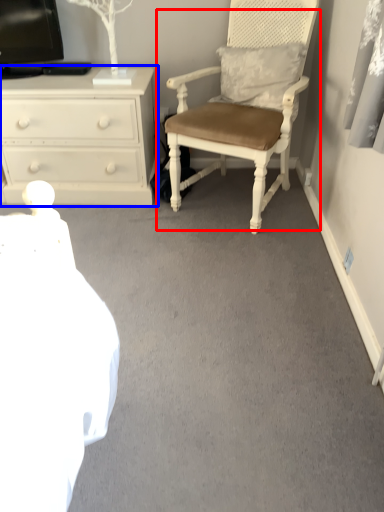
Question: Among these objects, which one is nearest to the camera, chair (highlighted by a red box) or chest of drawers (highlighted by a blue box)?

Choices:
 (A) chair
 (B) chest of drawers

Answer: (A)